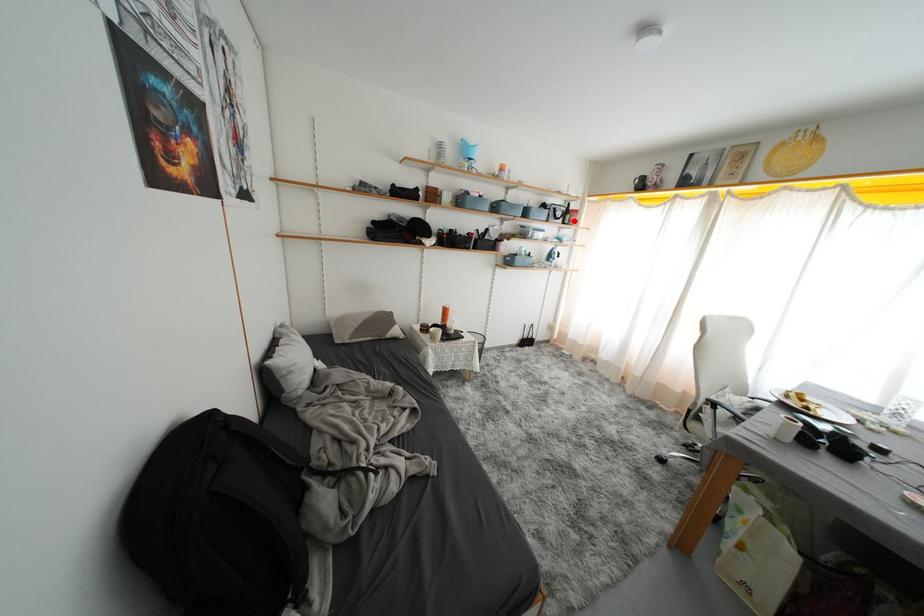
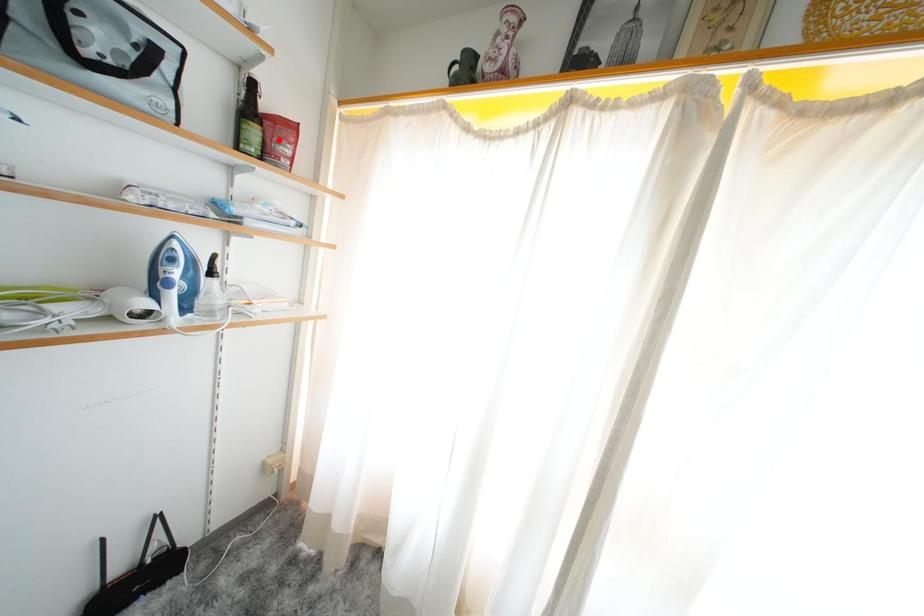
I am providing you with two images of the same scene from different viewpoints. A red point is marked on the first image and another point is marked on the second image. Do the highlighted points in image1 and image2 indicate the same real-world spot?

No